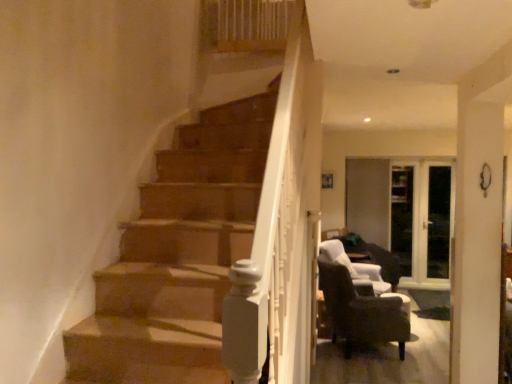
Question: From a real-world perspective, is transparent glass door at center, which is counted as the 1th glass door, starting from the left, over dark brown leather armchair at lower right, the 1th chair in the front-to-back sequence?

Choices:
 (A) no
 (B) yes

Answer: (B)

Question: Can you confirm if transparent glass door at center, which appears as the second glass door when viewed from the right, is wider than dark brown leather armchair at lower right, the 1th chair in the front-to-back sequence?

Choices:
 (A) no
 (B) yes

Answer: (A)

Question: Does transparent glass door at center, which is counted as the 1th glass door, starting from the left, have a lesser width compared to dark brown leather armchair at lower right, the 1th chair in the front-to-back sequence?

Choices:
 (A) yes
 (B) no

Answer: (A)

Question: Can you confirm if transparent glass door at center, which is counted as the 1th glass door, starting from the left, is bigger than dark brown leather armchair at lower right, the 1th chair in the front-to-back sequence?

Choices:
 (A) yes
 (B) no

Answer: (B)

Question: Does transparent glass door at center, which is counted as the 1th glass door, starting from the left, have a smaller size compared to dark brown leather armchair at lower right, arranged as the second chair when viewed from the back?

Choices:
 (A) yes
 (B) no

Answer: (A)

Question: From the image's perspective, is transparent glass door at right, which is the first glass door in right-to-left order, located above or below dark brown leather chair at lower right, which is the second chair from front to back?

Choices:
 (A) above
 (B) below

Answer: (A)

Question: Looking at their shapes, would you say transparent glass door at right, positioned as the second glass door in left-to-right order, is wider or thinner than dark brown leather chair at lower right, placed as the first chair when sorted from back to front?

Choices:
 (A) thin
 (B) wide

Answer: (A)

Question: Based on their sizes in the image, would you say transparent glass door at right, which is the first glass door in right-to-left order, is bigger or smaller than dark brown leather chair at lower right, which is the second chair from front to back?

Choices:
 (A) big
 (B) small

Answer: (B)

Question: From their relative heights in the image, would you say transparent glass door at right, which is the first glass door in right-to-left order, is taller or shorter than dark brown leather chair at lower right, placed as the first chair when sorted from back to front?

Choices:
 (A) short
 (B) tall

Answer: (B)

Question: Considering the positions of transparent glass door at center, which appears as the second glass door when viewed from the right, and dark brown leather armchair at lower right, arranged as the second chair when viewed from the back, in the image, is transparent glass door at center, which appears as the second glass door when viewed from the right, wider or thinner than dark brown leather armchair at lower right, arranged as the second chair when viewed from the back,?

Choices:
 (A) thin
 (B) wide

Answer: (A)

Question: Considering their positions, is transparent glass door at center, which appears as the second glass door when viewed from the right, located in front of or behind dark brown leather armchair at lower right, arranged as the second chair when viewed from the back?

Choices:
 (A) behind
 (B) front

Answer: (A)

Question: Is point (439, 246) closer or farther from the camera than point (392, 301)?

Choices:
 (A) closer
 (B) farther

Answer: (B)

Question: Based on their positions, is transparent glass door at center, which appears as the second glass door when viewed from the right, located to the left or right of dark brown leather armchair at lower right, arranged as the second chair when viewed from the back?

Choices:
 (A) left
 (B) right

Answer: (B)

Question: Is dark brown leather armchair at lower right, arranged as the second chair when viewed from the back, inside the boundaries of dark brown leather chair at lower right, which is the second chair from front to back, or outside?

Choices:
 (A) inside
 (B) outside

Answer: (B)

Question: In terms of size, does dark brown leather armchair at lower right, the 1th chair in the front-to-back sequence, appear bigger or smaller than dark brown leather chair at lower right, placed as the first chair when sorted from back to front?

Choices:
 (A) small
 (B) big

Answer: (B)